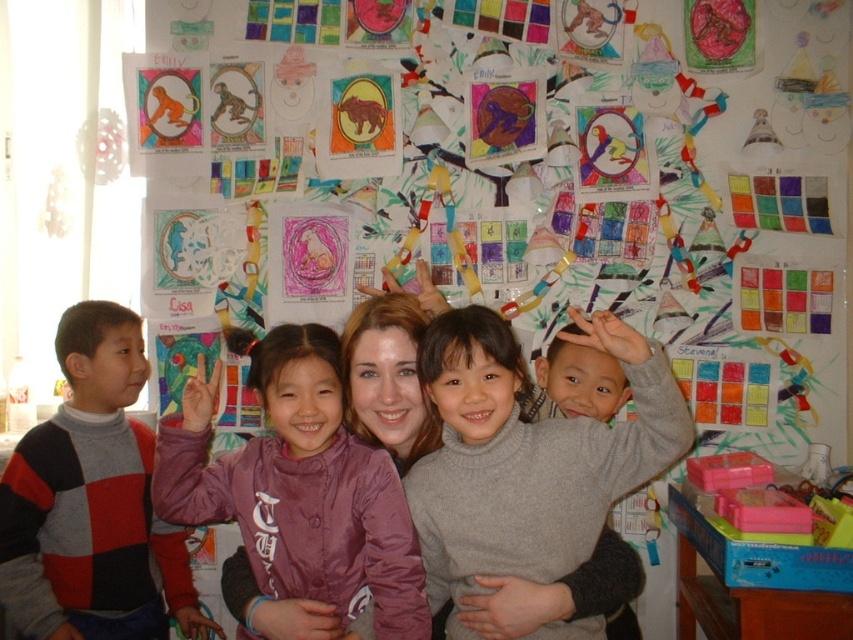
Who is taller, gray wool sweater at center or purple satin jacket at center?

gray wool sweater at center is taller.

Does gray wool sweater at center appear over purple satin jacket at center?

Indeed, gray wool sweater at center is positioned over purple satin jacket at center.

Is point (537, 474) less distant than point (332, 497)?

Yes, point (537, 474) is closer to viewer.

Where is `gray wool sweater at center`? gray wool sweater at center is located at coordinates (527, 452).

Who is lower down, purple satin jacket at center or striped sweater at left?

striped sweater at left is below.

Which is more to the left, purple satin jacket at center or striped sweater at left?

From the viewer's perspective, striped sweater at left appears more on the left side.

Is point (236, 506) positioned in front of point (132, 538)?

That is True.

You are a GUI agent. You are given a task and a screenshot of the screen. Output one action in this format:
    pyautogui.click(x=<x>, y=<y>)
    Task: Click on the purple satin jacket at center
    The image size is (853, 640).
    Given the screenshot: What is the action you would take?
    pyautogui.click(x=299, y=486)

Is point (584, 531) farther from viewer compared to point (141, 538)?

That is False.

Who is lower down, gray wool sweater at center or striped sweater at left?

striped sweater at left

At what (x,y) coordinates should I click in order to perform the action: click on gray wool sweater at center. Please return your answer as a coordinate pair (x, y). The height and width of the screenshot is (640, 853). Looking at the image, I should click on (527, 452).

Locate an element on the screen. This screenshot has width=853, height=640. gray wool sweater at center is located at coordinates coord(527,452).